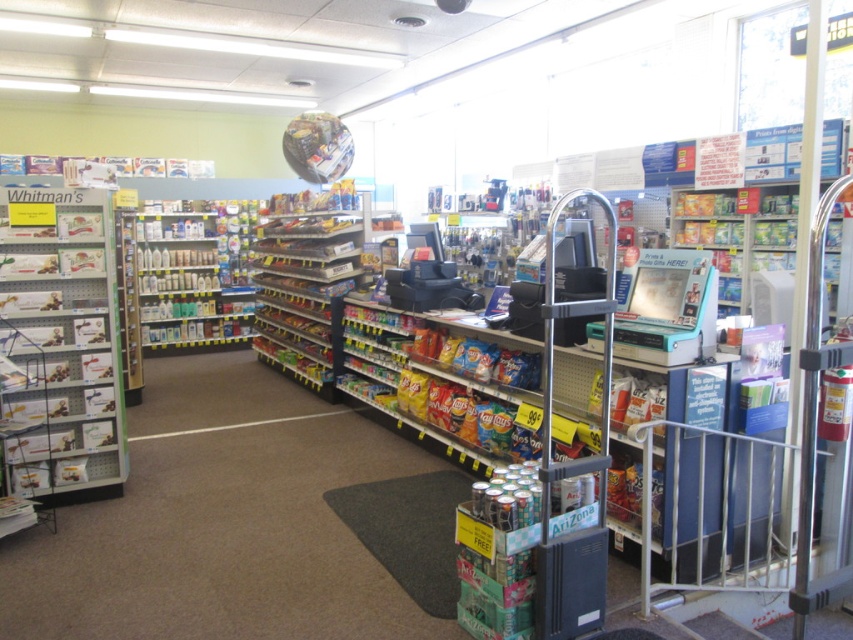
Question: Which object appears closest to the camera in this image?

Choices:
 (A) white plastic bottles at left
 (B) metallic silver candy at left

Answer: (B)

Question: Can you confirm if metallic silver candy at left is thinner than white plastic bottles at left?

Choices:
 (A) yes
 (B) no

Answer: (A)

Question: Among these points, which one is nearest to the camera?

Choices:
 (A) (239, 250)
 (B) (32, 451)

Answer: (B)

Question: Can you confirm if metallic silver candy at left is positioned to the right of white plastic bottles at left?

Choices:
 (A) no
 (B) yes

Answer: (B)

Question: Observing the image, what is the correct spatial positioning of metallic silver candy at left in reference to white plastic bottles at left?

Choices:
 (A) left
 (B) right

Answer: (B)